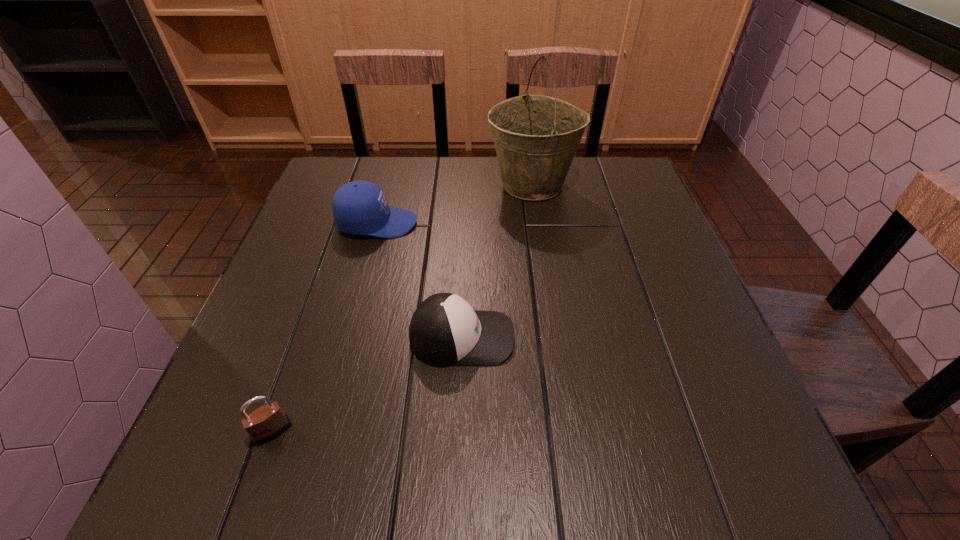
At what (x,y) coordinates should I click in order to perform the action: click on vacant space in between the nearer cap and the tallest object. Please return your answer as a coordinate pair (x, y). Looking at the image, I should click on (497, 261).

The height and width of the screenshot is (540, 960). Find the location of `vacant area that lies between the nearer cap and the wine bucket`. vacant area that lies between the nearer cap and the wine bucket is located at coordinates (497, 261).

Find the location of a particular element. The image size is (960, 540). free spot between the farther cap and the second nearest object is located at coordinates (420, 280).

Identify the location of free space that is in between the padlock and the tallest object. (402, 308).

Locate an element on the screen. This screenshot has width=960, height=540. free spot between the padlock and the farther cap is located at coordinates (324, 327).

Identify the location of free area in between the padlock and the left cap. (324, 327).

Where is `vacant space that's between the farther cap and the third farthest object`? vacant space that's between the farther cap and the third farthest object is located at coordinates (x=420, y=280).

This screenshot has height=540, width=960. I want to click on free area in between the nearest object and the wine bucket, so click(x=402, y=308).

Where is `free point between the second nearest object and the wine bucket`? The image size is (960, 540). free point between the second nearest object and the wine bucket is located at coordinates (497, 261).

Locate an element on the screen. The height and width of the screenshot is (540, 960). the closest object to the padlock is located at coordinates (445, 330).